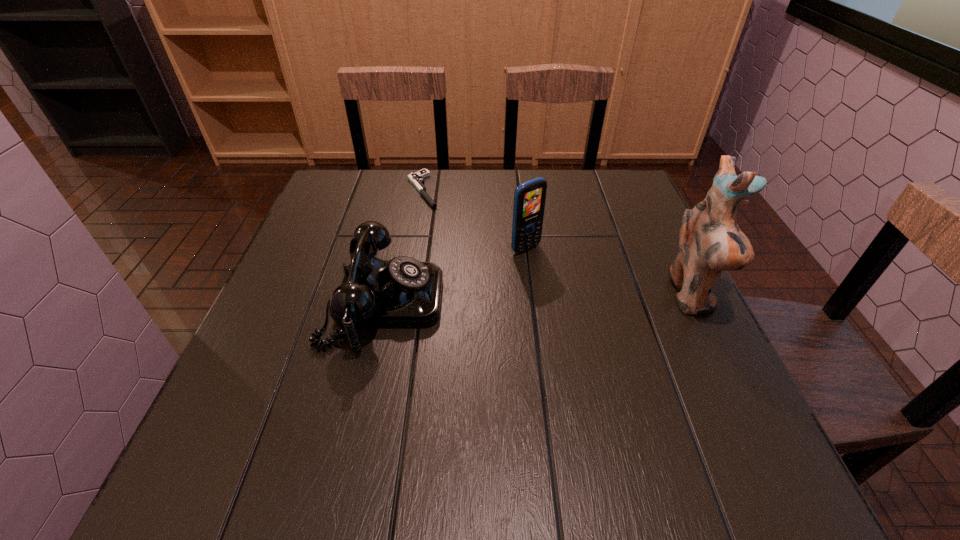
In order to click on free spot on the desktop that is between the telephone and the tallest object and is positioned on the screen of the second tallest object in this screenshot , I will do `click(584, 299)`.

Locate an element on the screen. The height and width of the screenshot is (540, 960). free space on the desktop that is between the third tallest object and the figurine and is positioned on the front-facing side of the shortest object is located at coordinates (516, 300).